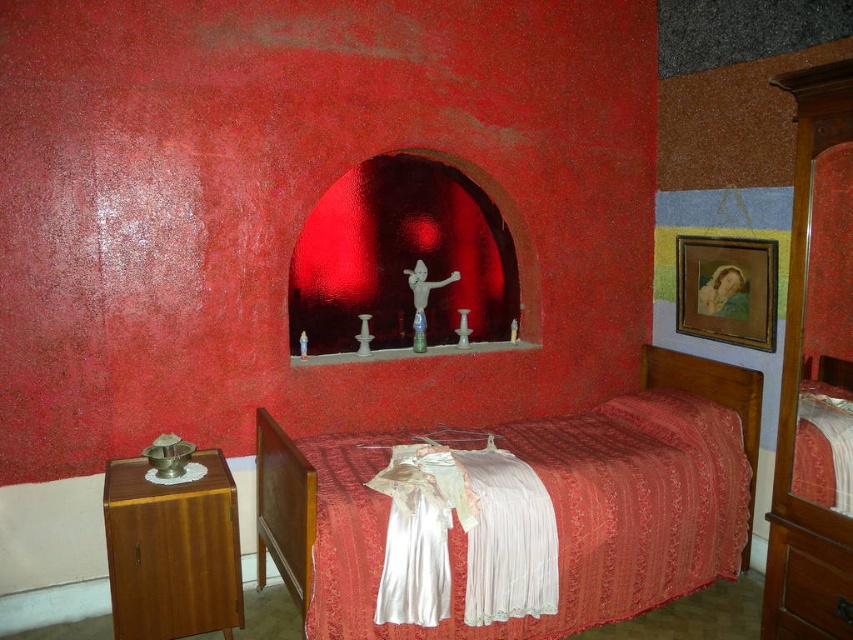
Question: Can you confirm if silky white fabric at center is positioned above silky red bed at center?

Choices:
 (A) yes
 (B) no

Answer: (B)

Question: Is wooden wardrobe at right to the left of silky red bed at center from the viewer's perspective?

Choices:
 (A) yes
 (B) no

Answer: (B)

Question: Which object is the closest to the wooden wardrobe at right?

Choices:
 (A) wooden dresser at left
 (B) wooden drawer at lower right
 (C) silky white fabric at center

Answer: (B)

Question: Which of the following is the closest to the observer?

Choices:
 (A) (775, 600)
 (B) (216, 532)
 (C) (775, 570)

Answer: (B)

Question: Which is farther from the wooden wardrobe at right?

Choices:
 (A) silky red bed at center
 (B) wooden dresser at left

Answer: (B)

Question: Is wooden dresser at left bigger than silky red bed at center?

Choices:
 (A) yes
 (B) no

Answer: (B)